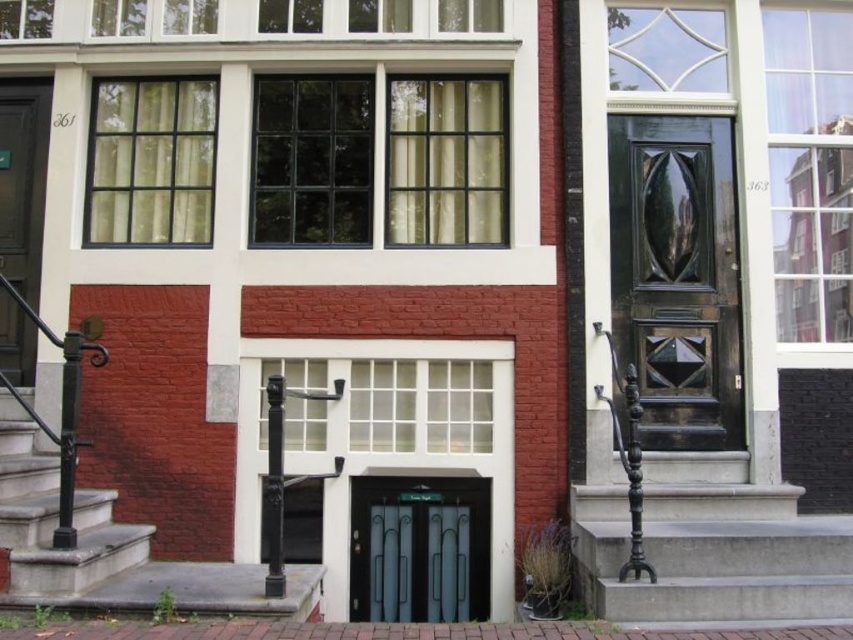
Question: Estimate the real-world distances between objects in this image. Which object is farther from the smooth concrete stairs at lower left?

Choices:
 (A) glossy wood door at right
 (B) matte black door at left
 (C) black metal/staircase at lower right
 (D) metallic gray door at center

Answer: (A)

Question: Does black metal/staircase at lower right appear on the left side of metallic gray door at center?

Choices:
 (A) no
 (B) yes

Answer: (A)

Question: Which of these objects is positioned closest to the matte black door at left?

Choices:
 (A) metallic gray door at center
 (B) black metal/staircase at lower right
 (C) smooth concrete stairs at lower left
 (D) glossy wood door at right

Answer: (C)

Question: Which object appears closest to the camera in this image?

Choices:
 (A) smooth concrete stairs at lower left
 (B) matte black door at left

Answer: (A)

Question: Is smooth concrete stairs at lower left to the right of matte black door at left from the viewer's perspective?

Choices:
 (A) yes
 (B) no

Answer: (A)

Question: Can you confirm if glossy wood door at right is positioned above matte black door at left?

Choices:
 (A) yes
 (B) no

Answer: (B)